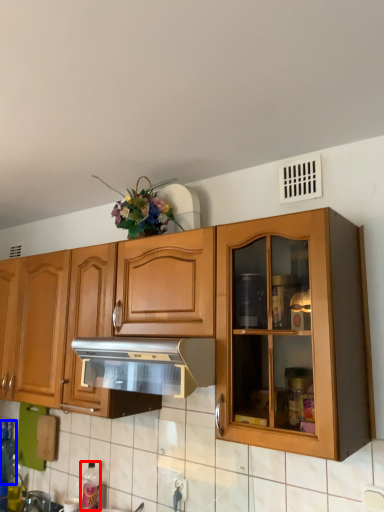
Question: Which point is closer to the camera, bottle (highlighted by a red box) or bottle (highlighted by a blue box)?

Choices:
 (A) bottle
 (B) bottle

Answer: (A)